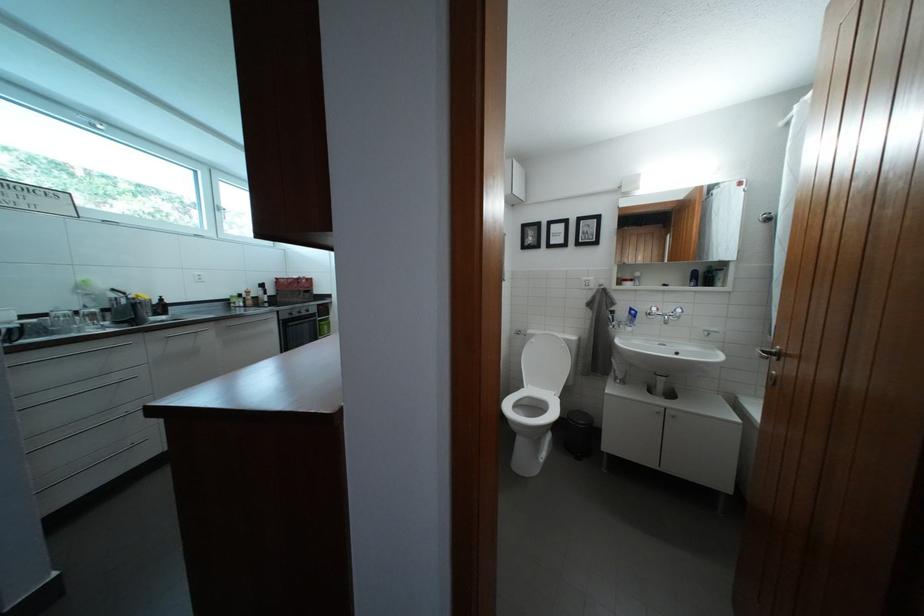
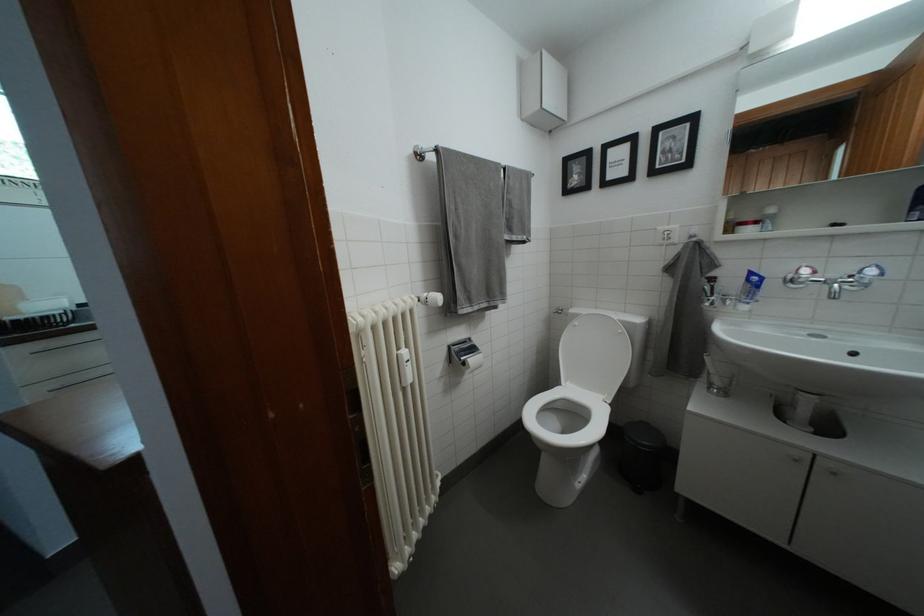
The point at [640,315] is marked in the first image. Where is the corresponding point in the second image?

(760, 280)